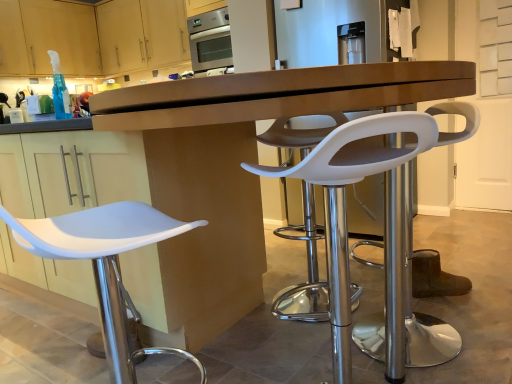
What do you see at coordinates (105, 263) in the screenshot? I see `white plastic stool at left, which is counted as the first chair, starting from the left` at bounding box center [105, 263].

Image resolution: width=512 pixels, height=384 pixels. Describe the element at coordinates (415, 286) in the screenshot. I see `white plastic stool at center, the first chair in the right-to-left sequence` at that location.

The height and width of the screenshot is (384, 512). Find the location of `matte wood cabinets at upper left, placed as the 2th cabinetry when sorted from left to right`. matte wood cabinets at upper left, placed as the 2th cabinetry when sorted from left to right is located at coordinates (141, 34).

Image resolution: width=512 pixels, height=384 pixels. Identify the location of white plastic stool at center, arranged as the second chair when viewed from the left. (344, 199).

Describe the element at coordinates (273, 98) in the screenshot. The height and width of the screenshot is (384, 512). I see `matte brown desk at center` at that location.

What do you see at coordinates (59, 89) in the screenshot? The width and height of the screenshot is (512, 384). I see `translucent blue plastic spray bottle at upper left` at bounding box center [59, 89].

Identify the location of white plastic stool at left, which is counted as the first chair, starting from the left. The height and width of the screenshot is (384, 512). (105, 263).

Locate an element on the screen. The height and width of the screenshot is (384, 512). desk located above the white plastic stool at center, arranged as the second chair when viewed from the left (from a real-world perspective) is located at coordinates (273, 98).

From a real-world perspective, does matte brown desk at center stand above white plastic stool at center, arranged as the second chair when viewed from the left?

Yes, from a real-world perspective, matte brown desk at center is on top of white plastic stool at center, arranged as the second chair when viewed from the left.

Is point (205, 116) farther from camera compared to point (348, 315)?

No, it is in front of (348, 315).

From the image's perspective, would you say white plastic stool at center, arranged as the second chair when viewed from the left, is shown under matte wood cabinets at upper left, placed as the 2th cabinetry when sorted from left to right?

Correct, white plastic stool at center, arranged as the second chair when viewed from the left, appears lower than matte wood cabinets at upper left, placed as the 2th cabinetry when sorted from left to right, in the image.

Is white plastic stool at center, arranged as the second chair when viewed from the left, positioned beyond the bounds of matte wood cabinets at upper left, arranged as the 1th cabinetry when viewed from the right?

That's correct, white plastic stool at center, arranged as the second chair when viewed from the left, is outside of matte wood cabinets at upper left, arranged as the 1th cabinetry when viewed from the right.

From a real-world perspective, which is physically below, white plastic stool at center, marked as the 2th chair in a right-to-left arrangement, or matte wood cabinets at upper left, placed as the 2th cabinetry when sorted from left to right?

In real-world perspective, white plastic stool at center, marked as the 2th chair in a right-to-left arrangement, is lower.

Does white plastic stool at center, marked as the 2th chair in a right-to-left arrangement, lie behind matte wood cabinets at upper left, placed as the 2th cabinetry when sorted from left to right?

No, white plastic stool at center, marked as the 2th chair in a right-to-left arrangement, is closer to the camera.

Is white plastic stool at center, which is counted as the 3th chair, starting from the left, next to translucent blue plastic spray bottle at upper left and touching it?

white plastic stool at center, which is counted as the 3th chair, starting from the left, and translucent blue plastic spray bottle at upper left are not in contact.

Based on their positions, is white plastic stool at center, which is counted as the 3th chair, starting from the left, located to the left or right of translucent blue plastic spray bottle at upper left?

white plastic stool at center, which is counted as the 3th chair, starting from the left, is to the right of translucent blue plastic spray bottle at upper left.

Can you confirm if white plastic stool at center, which is counted as the 3th chair, starting from the left, is taller than translucent blue plastic spray bottle at upper left?

Yes.

Does point (361, 348) come behind point (48, 54)?

That is False.

From the image's perspective, between white plastic stool at left, which is counted as the first chair, starting from the left, and matte wood cabinet at upper left, the 1th cabinetry when ordered from left to right, which one is located above?

From the image's view, matte wood cabinet at upper left, the 1th cabinetry when ordered from left to right, is above.

Is white plastic stool at left, placed as the 3th chair when sorted from right to left, inside the boundaries of matte wood cabinet at upper left, the 1th cabinetry when ordered from left to right, or outside?

white plastic stool at left, placed as the 3th chair when sorted from right to left, exists outside the volume of matte wood cabinet at upper left, the 1th cabinetry when ordered from left to right.

Is white plastic stool at left, which is counted as the first chair, starting from the left, positioned behind matte wood cabinet at upper left, marked as the 2th cabinetry in a right-to-left arrangement?

No, white plastic stool at left, which is counted as the first chair, starting from the left, is closer to the viewer.

Is matte brown desk at center facing away from white plastic stool at center, the first chair in the right-to-left sequence?

No.

This screenshot has width=512, height=384. I want to click on desk lying in front of the white plastic stool at center, which is counted as the 3th chair, starting from the left, so (x=273, y=98).

Is point (182, 117) more distant than point (378, 333)?

That is False.

From the image's perspective, relative to white plastic stool at center, which is counted as the 3th chair, starting from the left, is white plastic stool at center, marked as the 2th chair in a right-to-left arrangement, above or below?

Clearly, from the image's perspective, white plastic stool at center, marked as the 2th chair in a right-to-left arrangement, is below white plastic stool at center, which is counted as the 3th chair, starting from the left.

Is white plastic stool at center, marked as the 2th chair in a right-to-left arrangement, far from white plastic stool at center, the first chair in the right-to-left sequence?

They are positioned close to each other.

From a real-world perspective, is white plastic stool at center, arranged as the second chair when viewed from the left, positioned over white plastic stool at center, the first chair in the right-to-left sequence, based on gravity?

Incorrect, from a real-world perspective, white plastic stool at center, arranged as the second chair when viewed from the left, is lower than white plastic stool at center, the first chair in the right-to-left sequence.

Considering the sizes of objects white plastic stool at center, arranged as the second chair when viewed from the left, and white plastic stool at center, which is counted as the 3th chair, starting from the left, in the image provided, who is taller, white plastic stool at center, arranged as the second chair when viewed from the left, or white plastic stool at center, which is counted as the 3th chair, starting from the left,?

With more height is white plastic stool at center, arranged as the second chair when viewed from the left.

Is matte brown desk at center bigger or smaller than translucent blue plastic spray bottle at upper left?

Clearly, matte brown desk at center is larger in size than translucent blue plastic spray bottle at upper left.

Can you tell me how much matte brown desk at center and translucent blue plastic spray bottle at upper left differ in facing direction?

They differ by 47.4 degrees in their facing directions.

Which is correct: matte brown desk at center is inside translucent blue plastic spray bottle at upper left, or outside of it?

matte brown desk at center lies outside translucent blue plastic spray bottle at upper left.

Is the position of matte brown desk at center more distant than that of translucent blue plastic spray bottle at upper left?

No, it is in front of translucent blue plastic spray bottle at upper left.

Which chair is the 2nd one when counting from the back of the matte brown desk at center? Please provide its 2D coordinates.

[(344, 199)]

In order to click on the 2nd chair in front of the matte wood cabinets at upper left, arranged as the 1th cabinetry when viewed from the right in this screenshot , I will do `click(344, 199)`.

Estimate the real-world distances between objects in this image. Which object is closer to matte brown desk at center, matte wood cabinet at upper left, marked as the 2th cabinetry in a right-to-left arrangement, or white plastic stool at center, marked as the 2th chair in a right-to-left arrangement?

Based on the image, white plastic stool at center, marked as the 2th chair in a right-to-left arrangement, appears to be nearer to matte brown desk at center.

Considering their positions, is translucent blue plastic spray bottle at upper left positioned closer to white plastic stool at center, marked as the 2th chair in a right-to-left arrangement, than white plastic stool at center, the first chair in the right-to-left sequence?

white plastic stool at center, the first chair in the right-to-left sequence.

Looking at the image, which one is located further to matte wood cabinets at upper left, placed as the 2th cabinetry when sorted from left to right, matte brown desk at center or translucent blue plastic spray bottle at upper left?

Among the two, matte brown desk at center is located further to matte wood cabinets at upper left, placed as the 2th cabinetry when sorted from left to right.

When comparing their distances from white plastic stool at left, which is counted as the first chair, starting from the left, does translucent blue plastic spray bottle at upper left or matte wood cabinet at upper left, marked as the 2th cabinetry in a right-to-left arrangement, seem closer?

translucent blue plastic spray bottle at upper left is positioned closer to the anchor white plastic stool at left, which is counted as the first chair, starting from the left.

Which object lies nearer to the anchor point white plastic stool at center, the first chair in the right-to-left sequence, matte brown desk at center or translucent blue plastic spray bottle at upper left?

Among the two, matte brown desk at center is located nearer to white plastic stool at center, the first chair in the right-to-left sequence.

Consider the image. Considering their positions, is matte brown desk at center positioned closer to white plastic stool at left, placed as the 3th chair when sorted from right to left, than matte wood cabinets at upper left, placed as the 2th cabinetry when sorted from left to right?

Among the two, matte brown desk at center is located nearer to white plastic stool at left, placed as the 3th chair when sorted from right to left.

When comparing their distances from white plastic stool at center, the first chair in the right-to-left sequence, does white plastic stool at left, which is counted as the first chair, starting from the left, or white plastic stool at center, marked as the 2th chair in a right-to-left arrangement, seem further?

Based on the image, white plastic stool at left, which is counted as the first chair, starting from the left, appears to be further to white plastic stool at center, the first chair in the right-to-left sequence.

When comparing their distances from white plastic stool at center, marked as the 2th chair in a right-to-left arrangement, does translucent blue plastic spray bottle at upper left or matte wood cabinet at upper left, marked as the 2th cabinetry in a right-to-left arrangement, seem further?

matte wood cabinet at upper left, marked as the 2th cabinetry in a right-to-left arrangement, is positioned further to the anchor white plastic stool at center, marked as the 2th chair in a right-to-left arrangement.

Where is `cabinetry between translucent blue plastic spray bottle at upper left and matte wood cabinets at upper left, placed as the 2th cabinetry when sorted from left to right, along the z-axis`? This screenshot has height=384, width=512. cabinetry between translucent blue plastic spray bottle at upper left and matte wood cabinets at upper left, placed as the 2th cabinetry when sorted from left to right, along the z-axis is located at coordinates (61, 36).

In order to click on chair between white plastic stool at center, marked as the 2th chair in a right-to-left arrangement, and matte wood cabinet at upper left, the 1th cabinetry when ordered from left to right, from front to back in this screenshot , I will do `click(415, 286)`.

Image resolution: width=512 pixels, height=384 pixels. I want to click on chair between white plastic stool at center, arranged as the second chair when viewed from the left, and matte wood cabinets at upper left, placed as the 2th cabinetry when sorted from left to right, from front to back, so click(415, 286).

Locate an element on the screen. The width and height of the screenshot is (512, 384). bottle between white plastic stool at left, which is counted as the first chair, starting from the left, and matte wood cabinets at upper left, placed as the 2th cabinetry when sorted from left to right, in the front-back direction is located at coordinates (59, 89).